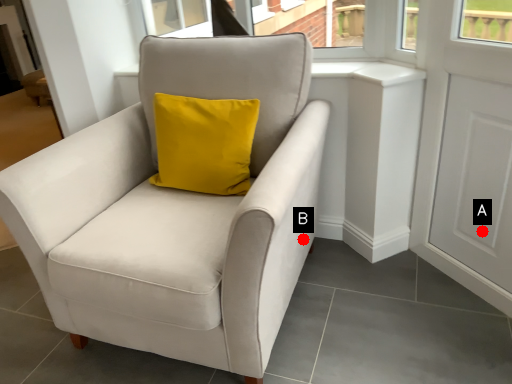
Question: Two points are circled on the image, labeled by A and B beside each circle. Which of the following is the farthest from the observer?

Choices:
 (A) A is further
 (B) B is further

Answer: (A)